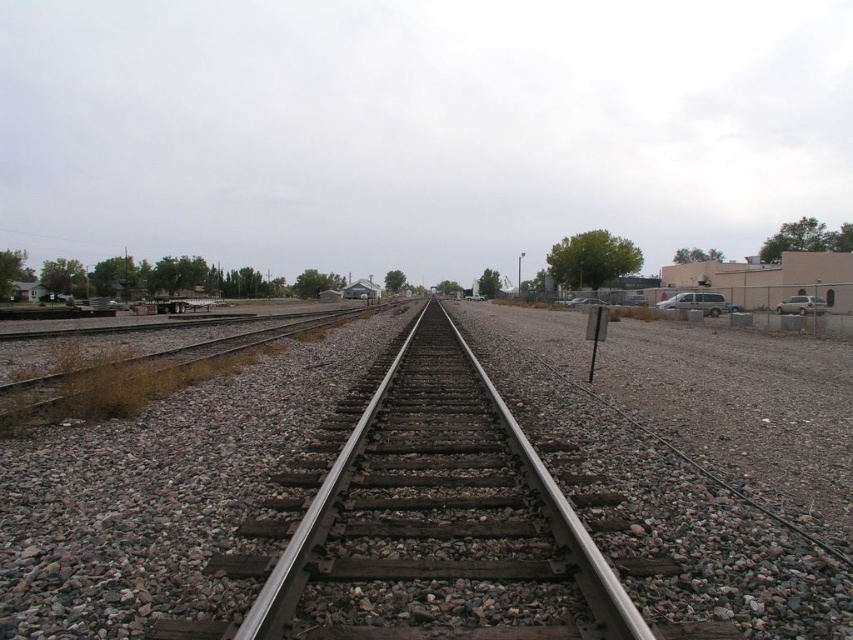
Can you confirm if gray gravel at center is bigger than metal/smooth train track at center?

Yes, gray gravel at center is bigger than metal/smooth train track at center.

In the scene shown: Who is positioned more to the right, gray gravel at center or metal/smooth train track at center?

gray gravel at center is more to the right.

The height and width of the screenshot is (640, 853). I want to click on gray gravel at center, so click(685, 470).

Find the location of `gray gravel at center`. gray gravel at center is located at coordinates (685, 470).